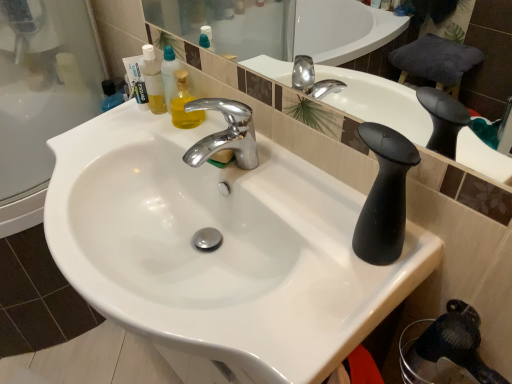
Question: Can you confirm if translucent plastic mouthwash at upper left is shorter than white glossy sink at center?

Choices:
 (A) no
 (B) yes

Answer: (B)

Question: Considering the relative sizes of translucent plastic mouthwash at upper left and white glossy sink at center in the image provided, is translucent plastic mouthwash at upper left bigger than white glossy sink at center?

Choices:
 (A) no
 (B) yes

Answer: (A)

Question: Is translucent plastic mouthwash at upper left at the right side of white glossy sink at center?

Choices:
 (A) yes
 (B) no

Answer: (B)

Question: From the image's perspective, is translucent plastic mouthwash at upper left over white glossy sink at center?

Choices:
 (A) no
 (B) yes

Answer: (B)

Question: Can you confirm if translucent plastic mouthwash at upper left is thinner than white glossy sink at center?

Choices:
 (A) no
 (B) yes

Answer: (B)

Question: From a real-world perspective, is white matte toothpaste tube at upper left positioned above or below translucent plastic mouthwash at upper left?

Choices:
 (A) below
 (B) above

Answer: (A)

Question: Does point (131, 87) appear closer or farther from the camera than point (146, 56)?

Choices:
 (A) closer
 (B) farther

Answer: (B)

Question: In the image, is white matte toothpaste tube at upper left on the left side or the right side of translucent plastic mouthwash at upper left?

Choices:
 (A) left
 (B) right

Answer: (A)

Question: From their relative heights in the image, would you say white matte toothpaste tube at upper left is taller or shorter than translucent plastic mouthwash at upper left?

Choices:
 (A) short
 (B) tall

Answer: (A)

Question: Is white matte toothpaste tube at upper left wider or thinner than white glossy sink at center?

Choices:
 (A) thin
 (B) wide

Answer: (A)

Question: Is point (133, 77) closer or farther from the camera than point (90, 150)?

Choices:
 (A) closer
 (B) farther

Answer: (B)

Question: Visually, is white matte toothpaste tube at upper left positioned to the left or to the right of white glossy sink at center?

Choices:
 (A) right
 (B) left

Answer: (B)

Question: From the image's perspective, relative to white glossy sink at center, is white matte toothpaste tube at upper left above or below?

Choices:
 (A) below
 (B) above

Answer: (B)

Question: Is translucent plastic mouthwash at upper left in front of or behind white matte toothpaste tube at upper left in the image?

Choices:
 (A) behind
 (B) front

Answer: (B)

Question: From a real-world perspective, is translucent plastic mouthwash at upper left physically located above or below white matte toothpaste tube at upper left?

Choices:
 (A) above
 (B) below

Answer: (A)